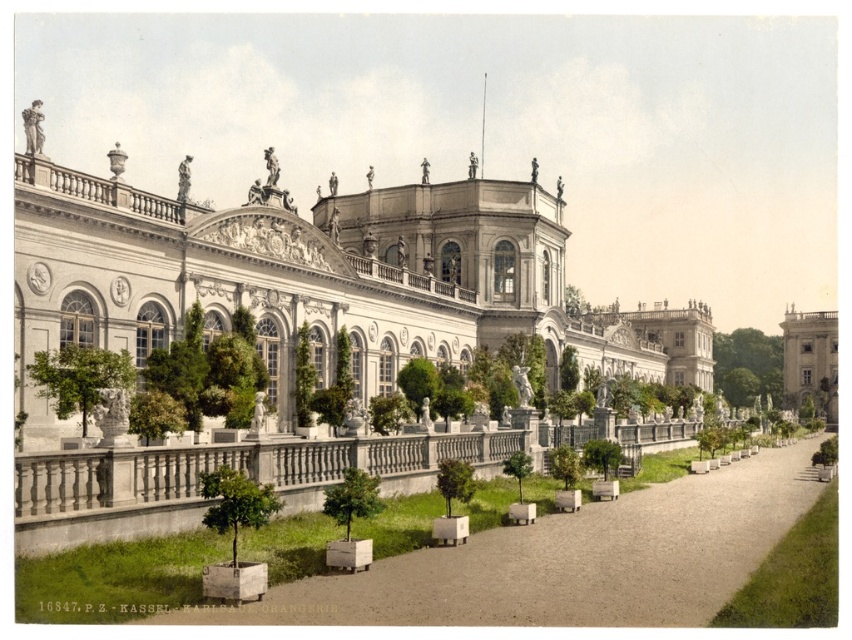
Between smooth concrete path at center and stone/concrete building at right, which one is positioned lower?

smooth concrete path at center is below.

Is point (630, 525) in front of point (830, 337)?

That is True.

Where is `smooth concrete path at center`? Image resolution: width=852 pixels, height=640 pixels. smooth concrete path at center is located at coordinates (568, 561).

Which is above, white stone palace at center or smooth concrete path at center?

white stone palace at center

What do you see at coordinates (320, 280) in the screenshot? I see `white stone palace at center` at bounding box center [320, 280].

At what (x,y) coordinates should I click in order to perform the action: click on white stone palace at center. Please return your answer as a coordinate pair (x, y). Looking at the image, I should click on (320, 280).

Find the location of `white stone palace at center`. white stone palace at center is located at coordinates (320, 280).

From the picture: Can you confirm if white stone palace at center is smaller than stone/concrete building at right?

Actually, white stone palace at center might be larger than stone/concrete building at right.

Can you confirm if white stone palace at center is bigger than stone/concrete building at right?

Indeed, white stone palace at center has a larger size compared to stone/concrete building at right.

Is point (527, 296) positioned behind point (798, 401)?

That is False.

You are a GUI agent. You are given a task and a screenshot of the screen. Output one action in this format:
    pyautogui.click(x=<x>, y=<y>)
    Task: Click on the white stone palace at center
    
    Given the screenshot: What is the action you would take?
    pyautogui.click(x=320, y=280)